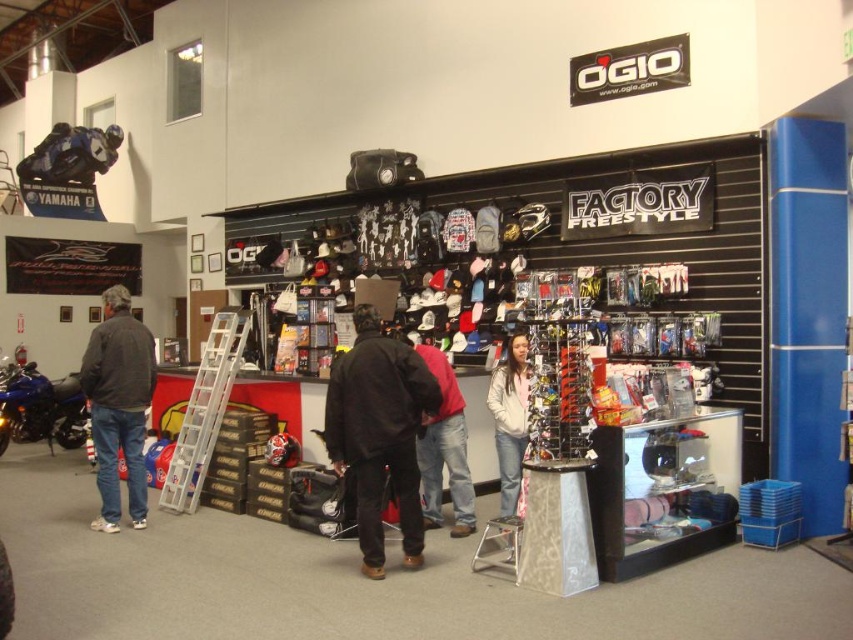
Can you confirm if black matte jacket at center is thinner than silver metallic stool at center?

In fact, black matte jacket at center might be wider than silver metallic stool at center.

Does black matte jacket at center appear under silver metallic stool at center?

Actually, black matte jacket at center is above silver metallic stool at center.

I want to click on black matte jacket at center, so click(x=379, y=433).

Is dark gray jacket at left to the right of white fleece jacket at center from the viewer's perspective?

In fact, dark gray jacket at left is to the left of white fleece jacket at center.

Which is behind, point (120, 440) or point (514, 435)?

The point (120, 440) is behind.

What do you see at coordinates (119, 404) in the screenshot? The height and width of the screenshot is (640, 853). I see `dark gray jacket at left` at bounding box center [119, 404].

What are the coordinates of `dark gray jacket at left` in the screenshot? It's located at (119, 404).

This screenshot has width=853, height=640. What do you see at coordinates (379, 433) in the screenshot? I see `black matte jacket at center` at bounding box center [379, 433].

Describe the element at coordinates (379, 433) in the screenshot. The image size is (853, 640). I see `black matte jacket at center` at that location.

Where is `black matte jacket at center`? The width and height of the screenshot is (853, 640). black matte jacket at center is located at coordinates (379, 433).